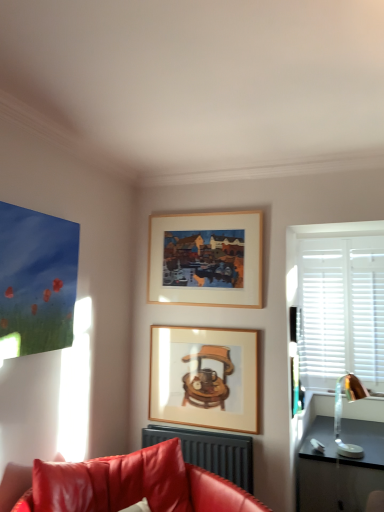
The width and height of the screenshot is (384, 512). I want to click on matte black radiator at lower center, so pyautogui.click(x=210, y=451).

This screenshot has width=384, height=512. What are the coordinates of `wooden frame at upper center, which appears as the first picture frame when viewed from the top` in the screenshot? It's located at 206,259.

Measure the distance between point (162, 269) and camera.

Point (162, 269) and camera are 3.28 meters apart from each other.

In order to face leather couch at lower left, should I rotate leftwards or rightwards?

Rotate your view left by about 6.796°.

The height and width of the screenshot is (512, 384). Describe the element at coordinates (136, 484) in the screenshot. I see `leather couch at lower left` at that location.

At what (x,y) coordinates should I click in order to perform the action: click on matte black radiator at lower center. Please return your answer as a coordinate pair (x, y). This screenshot has width=384, height=512. Looking at the image, I should click on (210, 451).

From a real-world perspective, is leather couch at lower left over wooden picture frame at center, the second picture frame in the top-to-bottom sequence?

No, from a real-world perspective, leather couch at lower left is not on top of wooden picture frame at center, the second picture frame in the top-to-bottom sequence.

Is leather couch at lower left wider than wooden picture frame at center, marked as the first picture frame in a bottom-to-top arrangement?

Yes.

How many degrees apart are the facing directions of leather couch at lower left and wooden picture frame at center, the second picture frame in the top-to-bottom sequence?

77.8 degrees.

From the image's perspective, is leather couch at lower left positioned above or below wooden picture frame at center, marked as the first picture frame in a bottom-to-top arrangement?

From the image's perspective, leather couch at lower left appears below wooden picture frame at center, marked as the first picture frame in a bottom-to-top arrangement.

From the image's perspective, is matte black radiator at lower center under leather couch at lower left?

Yes, from the image's perspective, matte black radiator at lower center is beneath leather couch at lower left.

Is matte black radiator at lower center next to leather couch at lower left?

No, matte black radiator at lower center is not in contact with leather couch at lower left.

Which is correct: metallic gold lamp at right is inside wooden picture frame at center, marked as the first picture frame in a bottom-to-top arrangement, or outside of it?

metallic gold lamp at right cannot be found inside wooden picture frame at center, marked as the first picture frame in a bottom-to-top arrangement.

How distant is metallic gold lamp at right from wooden picture frame at center, marked as the first picture frame in a bottom-to-top arrangement?

A distance of 4.51 feet exists between metallic gold lamp at right and wooden picture frame at center, marked as the first picture frame in a bottom-to-top arrangement.

How many degrees apart are the facing directions of metallic gold lamp at right and wooden picture frame at center, the second picture frame in the top-to-bottom sequence?

88.1 degrees.

Which of these two, metallic gold lamp at right or wooden picture frame at center, marked as the first picture frame in a bottom-to-top arrangement, stands taller?

wooden picture frame at center, marked as the first picture frame in a bottom-to-top arrangement.

Is matte black radiator at lower center completely or partially outside of wooden picture frame at center, the second picture frame in the top-to-bottom sequence?

Yes, matte black radiator at lower center is not within wooden picture frame at center, the second picture frame in the top-to-bottom sequence.

Is matte black radiator at lower center at the left side of wooden picture frame at center, the second picture frame in the top-to-bottom sequence?

Correct, you'll find matte black radiator at lower center to the left of wooden picture frame at center, the second picture frame in the top-to-bottom sequence.

Find the location of a particular element. radiator on the left of wooden picture frame at center, marked as the first picture frame in a bottom-to-top arrangement is located at coordinates (210, 451).

Considering the sizes of wooden picture frame at center, marked as the first picture frame in a bottom-to-top arrangement, and wooden frame at upper center, which appears as the first picture frame when viewed from the top, in the image, is wooden picture frame at center, marked as the first picture frame in a bottom-to-top arrangement, bigger or smaller than wooden frame at upper center, which appears as the first picture frame when viewed from the top,?

In the image, wooden picture frame at center, marked as the first picture frame in a bottom-to-top arrangement, appears to be smaller than wooden frame at upper center, which appears as the first picture frame when viewed from the top.

How different are the orientations of wooden picture frame at center, marked as the first picture frame in a bottom-to-top arrangement, and wooden frame at upper center, which appears as the first picture frame when viewed from the top, in degrees?

0.00415 degrees separate the facing orientations of wooden picture frame at center, marked as the first picture frame in a bottom-to-top arrangement, and wooden frame at upper center, which appears as the first picture frame when viewed from the top.

Is point (243, 389) positioned after point (167, 269)?

No, (243, 389) is closer to viewer.

Is wooden picture frame at center, the second picture frame in the top-to-bottom sequence, shorter than wooden frame at upper center, marked as the second picture frame in a bottom-to-top arrangement?

Indeed, wooden picture frame at center, the second picture frame in the top-to-bottom sequence, has a lesser height compared to wooden frame at upper center, marked as the second picture frame in a bottom-to-top arrangement.

Is wooden frame at upper center, marked as the second picture frame in a bottom-to-top arrangement, outside of metallic gold lamp at right?

Yes, wooden frame at upper center, marked as the second picture frame in a bottom-to-top arrangement, is not within metallic gold lamp at right.

Is wooden frame at upper center, marked as the second picture frame in a bottom-to-top arrangement, turned away from metallic gold lamp at right?

No, wooden frame at upper center, marked as the second picture frame in a bottom-to-top arrangement,'s orientation is not away from metallic gold lamp at right.

Considering the sizes of objects wooden frame at upper center, marked as the second picture frame in a bottom-to-top arrangement, and metallic gold lamp at right in the image provided, who is taller, wooden frame at upper center, marked as the second picture frame in a bottom-to-top arrangement, or metallic gold lamp at right?

Standing taller between the two is wooden frame at upper center, marked as the second picture frame in a bottom-to-top arrangement.

Is point (202, 257) closer or farther from the camera than point (346, 453)?

Point (202, 257) is positioned farther from the camera compared to point (346, 453).

The image size is (384, 512). In order to click on picture frame in front of the wooden frame at upper center, which appears as the first picture frame when viewed from the top in this screenshot , I will do `click(204, 377)`.

In the scene shown: Between wooden frame at upper center, which appears as the first picture frame when viewed from the top, and wooden picture frame at center, the second picture frame in the top-to-bottom sequence, which one is positioned in front?

Positioned in front is wooden picture frame at center, the second picture frame in the top-to-bottom sequence.

Is wooden frame at upper center, which appears as the first picture frame when viewed from the top, to the left or to the right of wooden picture frame at center, marked as the first picture frame in a bottom-to-top arrangement, in the image?

wooden frame at upper center, which appears as the first picture frame when viewed from the top, is positioned on wooden picture frame at center, marked as the first picture frame in a bottom-to-top arrangement,'s right side.

Is wooden frame at upper center, marked as the second picture frame in a bottom-to-top arrangement, wider or thinner than wooden picture frame at center, the second picture frame in the top-to-bottom sequence?

wooden frame at upper center, marked as the second picture frame in a bottom-to-top arrangement, is wider than wooden picture frame at center, the second picture frame in the top-to-bottom sequence.

Which picture frame is the 1st one when counting from the back of the leather couch at lower left? Please provide its 2D coordinates.

[(204, 377)]

Where is `studio couch on the left side of matte black radiator at lower center`? Image resolution: width=384 pixels, height=512 pixels. studio couch on the left side of matte black radiator at lower center is located at coordinates (136, 484).

When comparing their distances from wooden frame at upper center, which appears as the first picture frame when viewed from the top, does metallic gold lamp at right or wooden picture frame at center, marked as the first picture frame in a bottom-to-top arrangement, seem closer?

wooden picture frame at center, marked as the first picture frame in a bottom-to-top arrangement.

When comparing their distances from metallic gold lamp at right, does wooden picture frame at center, the second picture frame in the top-to-bottom sequence, or wooden frame at upper center, which appears as the first picture frame when viewed from the top, seem further?

Based on the image, wooden frame at upper center, which appears as the first picture frame when viewed from the top, appears to be further to metallic gold lamp at right.

From the image, which object appears to be nearer to wooden picture frame at center, the second picture frame in the top-to-bottom sequence, leather couch at lower left or matte black radiator at lower center?

matte black radiator at lower center.

When comparing their distances from wooden picture frame at center, marked as the first picture frame in a bottom-to-top arrangement, does matte black radiator at lower center or leather couch at lower left seem further?

leather couch at lower left is further to wooden picture frame at center, marked as the first picture frame in a bottom-to-top arrangement.

Which object lies further to the anchor point matte black radiator at lower center, leather couch at lower left or wooden frame at upper center, which appears as the first picture frame when viewed from the top?

wooden frame at upper center, which appears as the first picture frame when viewed from the top, is further to matte black radiator at lower center.

Based on their spatial positions, is wooden frame at upper center, marked as the second picture frame in a bottom-to-top arrangement, or leather couch at lower left further from matte black radiator at lower center?

wooden frame at upper center, marked as the second picture frame in a bottom-to-top arrangement, is positioned further to the anchor matte black radiator at lower center.

Considering their positions, is wooden picture frame at center, the second picture frame in the top-to-bottom sequence, positioned closer to matte black radiator at lower center than leather couch at lower left?

Based on the image, wooden picture frame at center, the second picture frame in the top-to-bottom sequence, appears to be nearer to matte black radiator at lower center.

Estimate the real-world distances between objects in this image. Which object is closer to leather couch at lower left, wooden frame at upper center, marked as the second picture frame in a bottom-to-top arrangement, or metallic gold lamp at right?

The object closer to leather couch at lower left is wooden frame at upper center, marked as the second picture frame in a bottom-to-top arrangement.

This screenshot has width=384, height=512. I want to click on radiator between leather couch at lower left and metallic gold lamp at right from front to back, so click(x=210, y=451).

The height and width of the screenshot is (512, 384). I want to click on picture frame between wooden picture frame at center, marked as the first picture frame in a bottom-to-top arrangement, and metallic gold lamp at right, in the horizontal direction, so click(x=206, y=259).

Locate an element on the screen. The height and width of the screenshot is (512, 384). lamp between leather couch at lower left and wooden frame at upper center, marked as the second picture frame in a bottom-to-top arrangement, from front to back is located at coordinates pyautogui.click(x=341, y=412).

Find the location of a particular element. The image size is (384, 512). radiator positioned between leather couch at lower left and wooden picture frame at center, marked as the first picture frame in a bottom-to-top arrangement, from near to far is located at coordinates (210, 451).